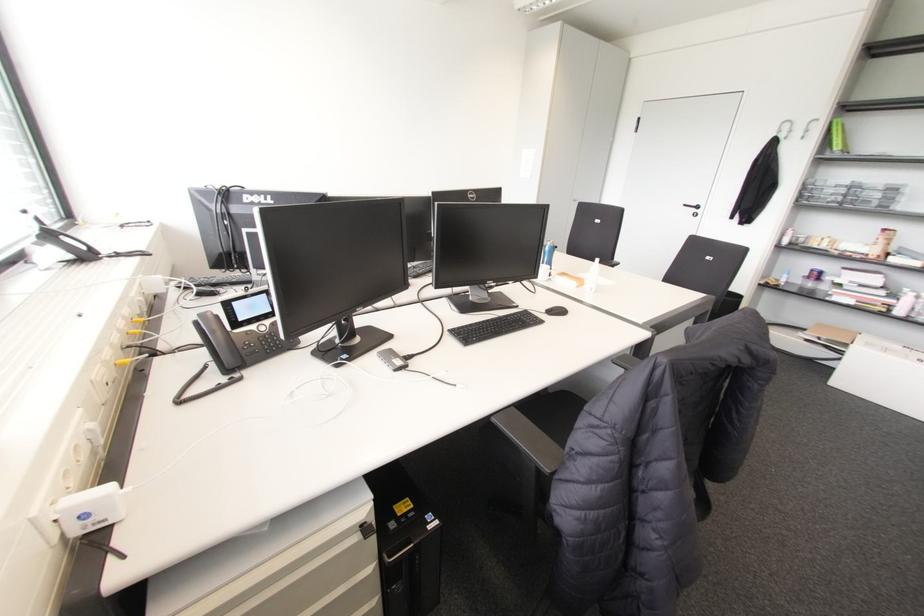
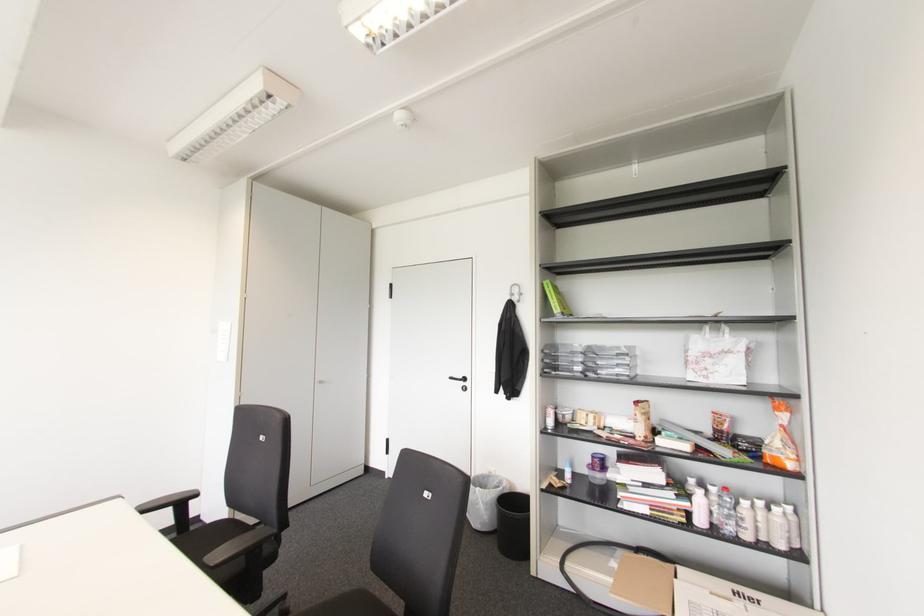
In the second image, find the point that corresponds to (x=697, y=207) in the first image.

(464, 379)